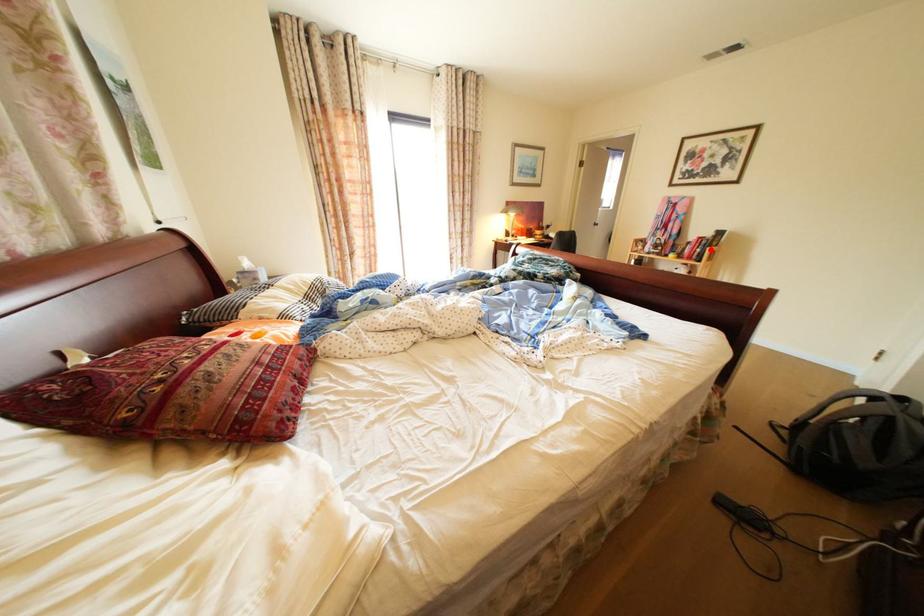
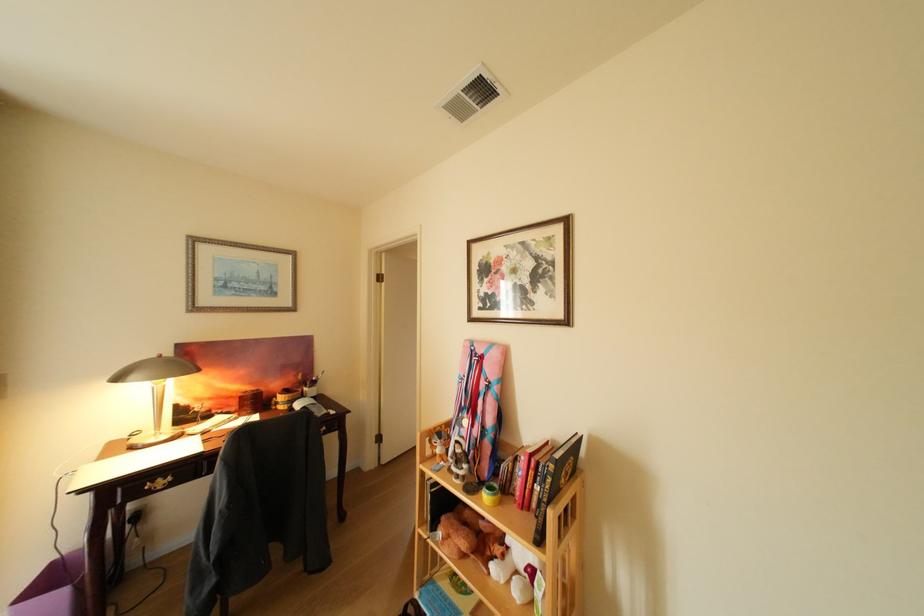
Question: I am providing you with two images of the same scene from different viewpoints. A red point is marked on the first image. Can you still see the location of the red point in image 2?

Choices:
 (A) Yes
 (B) No

Answer: (A)